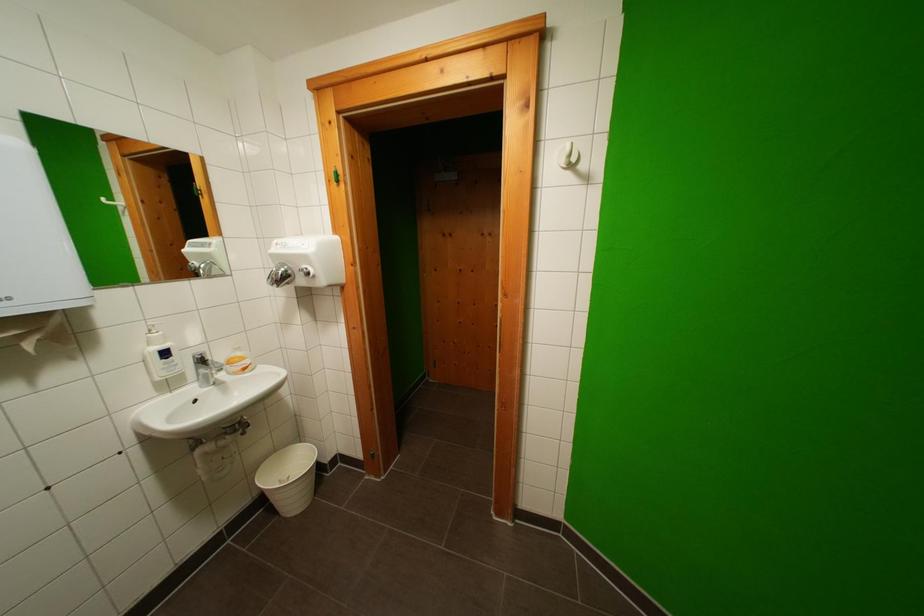
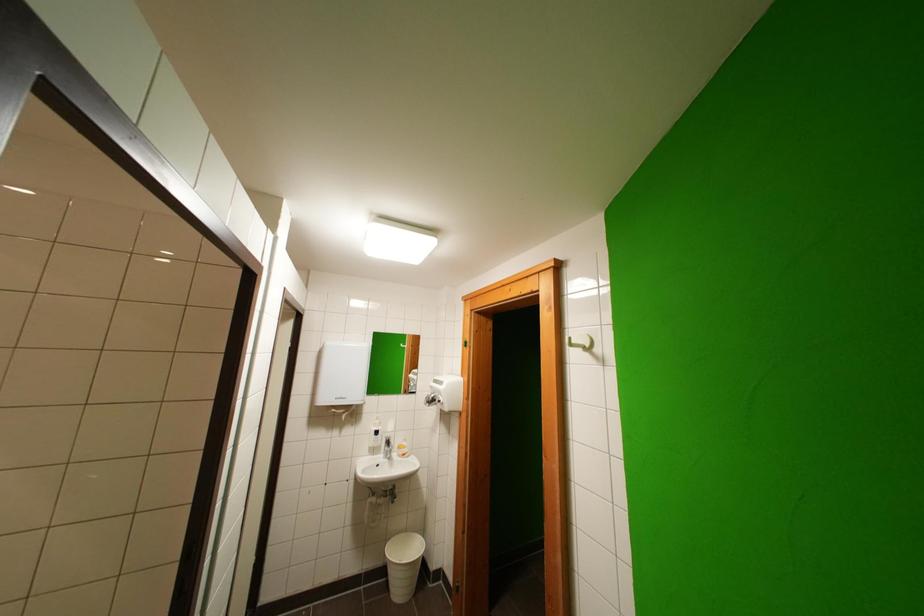
Find the pixel in the second image that matches pixel 172 357 in the first image.

(383, 436)